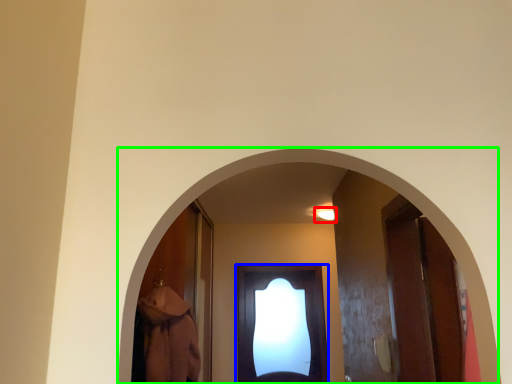
Question: Estimate the real-world distances between objects in this image. Which object is farther from light (highlighted by a red box), door (highlighted by a blue box) or archway (highlighted by a green box)?

Choices:
 (A) door
 (B) archway

Answer: (B)